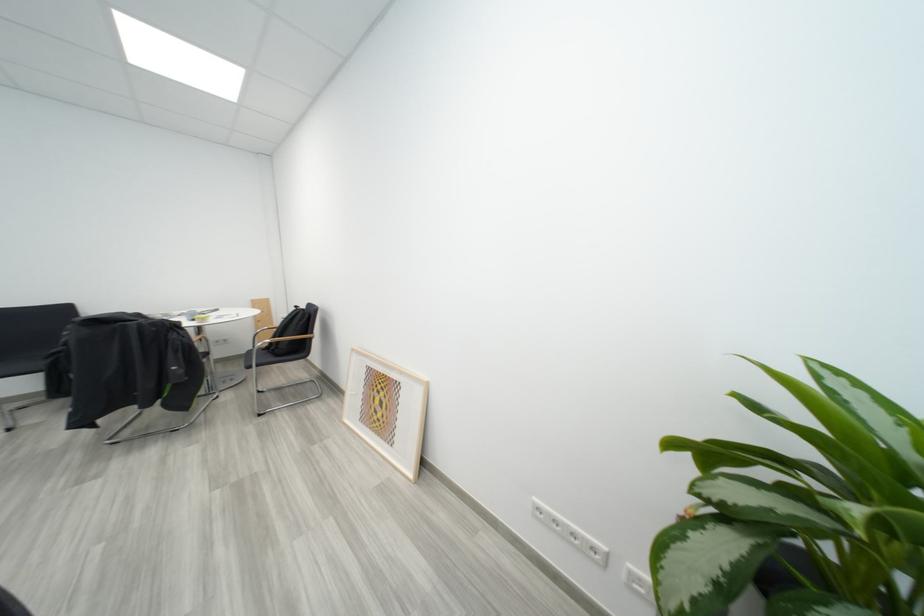
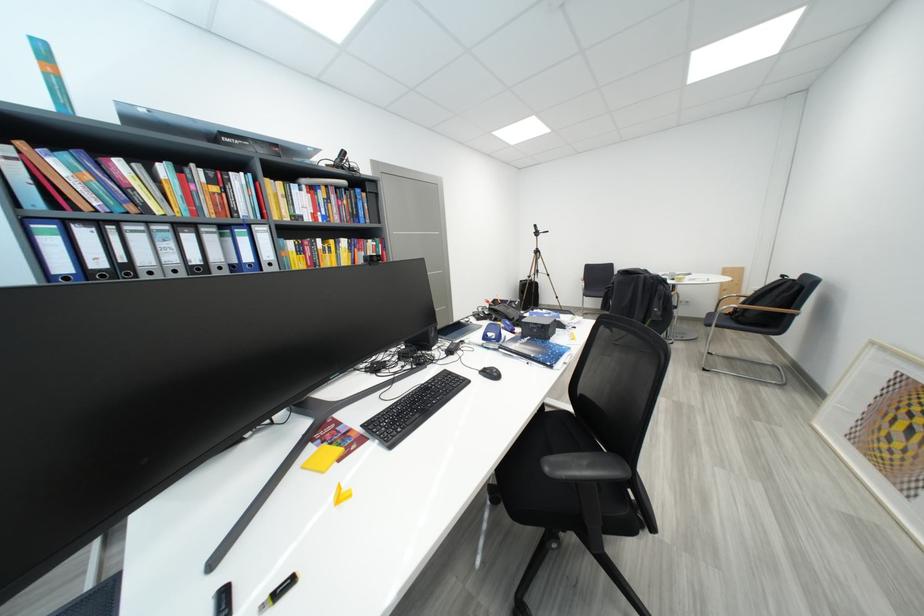
In the second image, find the point that corresponds to point 306,336 in the first image.

(783, 310)